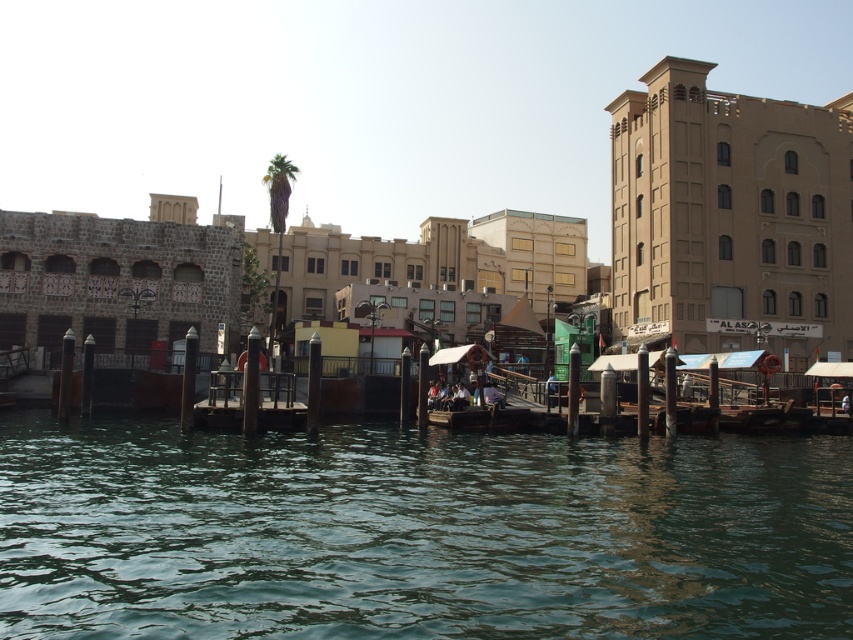
You are standing on the wooden dock at center and want to locate the greenish water at center. According to the scene, where should you look relative to your position?

The greenish water at center is to the right of the wooden dock at center, so you should look to your right to find it.

You are a visitor standing at the wooden dock at center and want to take a photo of the brown textured building at upper right. Is the building visible from your current position?

The brown textured building at upper right is located above the wooden dock at center, so it should be visible from your position at the wooden dock at center as it is positioned higher up.